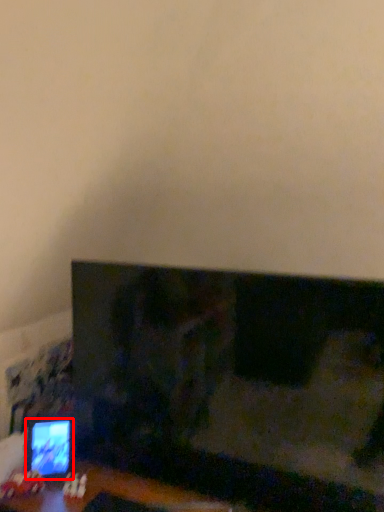
Question: Where is computer monitor (annotated by the red box) located in relation to television in the image?

Choices:
 (A) right
 (B) left

Answer: (B)